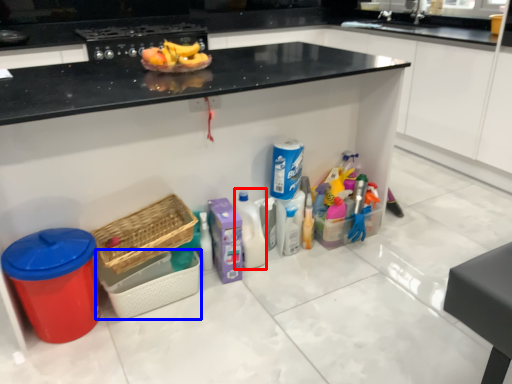
Question: Which point is further to the camera, cleaning product (highlighted by a red box) or basket (highlighted by a blue box)?

Choices:
 (A) cleaning product
 (B) basket

Answer: (A)